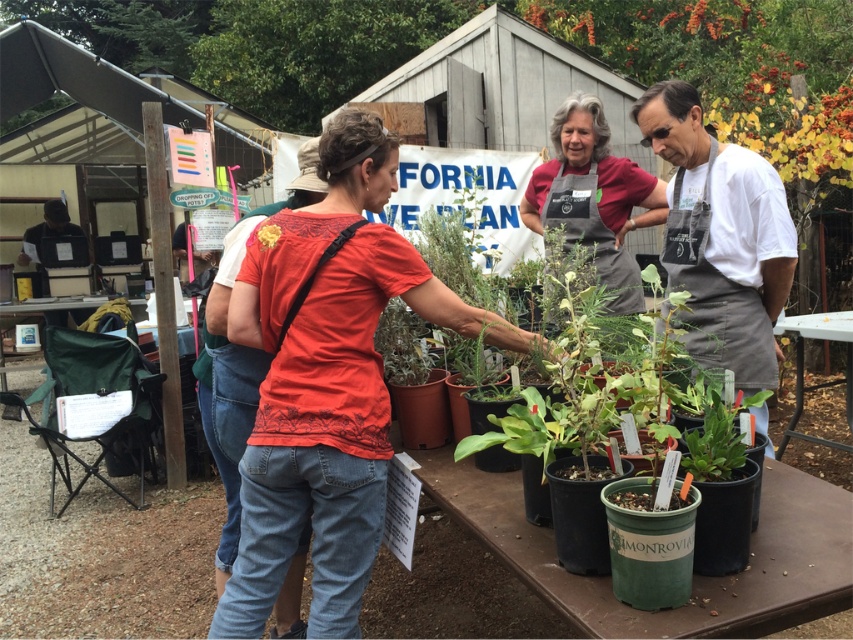
Which is behind, point (596, 236) or point (260, 243)?

Point (596, 236)

Is point (601, 198) farther from viewer compared to point (260, 250)?

Yes.

Locate an element on the screen. This screenshot has height=640, width=853. matte gray apron at center is located at coordinates (595, 196).

Which is more to the left, matte red shirt at center or white apron at center?

From the viewer's perspective, matte red shirt at center appears more on the left side.

Where is `matte red shirt at center`? The image size is (853, 640). matte red shirt at center is located at coordinates (328, 384).

The height and width of the screenshot is (640, 853). What are the coordinates of `matte red shirt at center` in the screenshot? It's located at (328, 384).

The width and height of the screenshot is (853, 640). Find the location of `matte red shirt at center`. matte red shirt at center is located at coordinates (328, 384).

Which is behind, point (694, 250) or point (268, 243)?

The point (694, 250) is more distant.

Can you confirm if white apron at center is wider than yellow fabric flower at center?

Indeed, white apron at center has a greater width compared to yellow fabric flower at center.

What do you see at coordinates (720, 234) in the screenshot? Image resolution: width=853 pixels, height=640 pixels. I see `white apron at center` at bounding box center [720, 234].

Find the location of `white apron at center`. white apron at center is located at coordinates (720, 234).